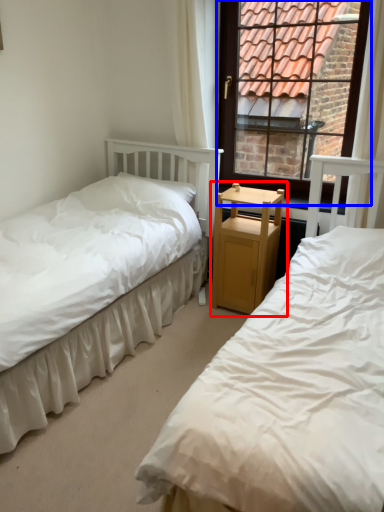
Question: Which object appears farthest to the camera in this image, nightstand (highlighted by a red box) or window (highlighted by a blue box)?

Choices:
 (A) nightstand
 (B) window

Answer: (A)